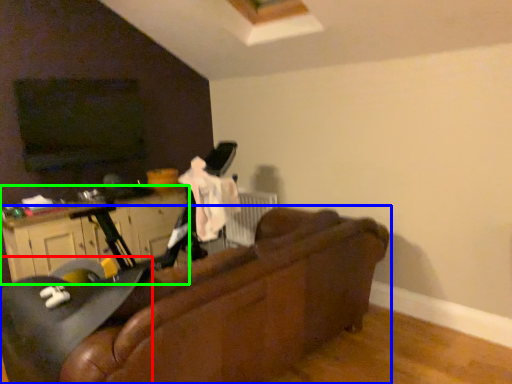
Question: Based on their relative distances, which object is farther from swivel chair (highlighted by a red box)? Choose from studio couch (highlighted by a blue box) and dresser (highlighted by a green box).

Choices:
 (A) studio couch
 (B) dresser

Answer: (B)